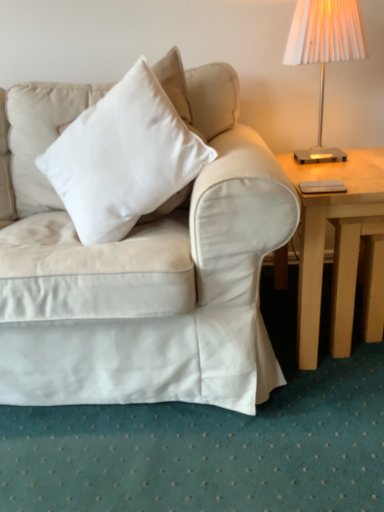
The width and height of the screenshot is (384, 512). What are the coordinates of `free space in front of light wood table at right` in the screenshot? It's located at (317, 420).